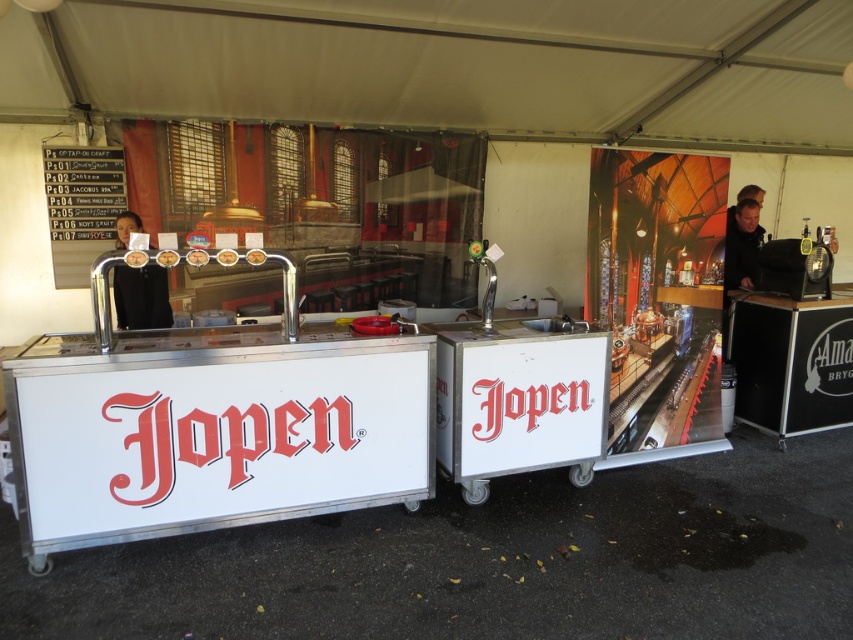
Can you confirm if black shirt at left is positioned to the left of dark brown leather jacket at upper right?

Indeed, black shirt at left is positioned on the left side of dark brown leather jacket at upper right.

Can you confirm if black shirt at left is positioned below dark brown leather jacket at upper right?

Yes, black shirt at left is below dark brown leather jacket at upper right.

Where is `black shirt at left`? Image resolution: width=853 pixels, height=640 pixels. black shirt at left is located at coordinates (141, 298).

Image resolution: width=853 pixels, height=640 pixels. Find the location of `black shirt at left`. black shirt at left is located at coordinates (141, 298).